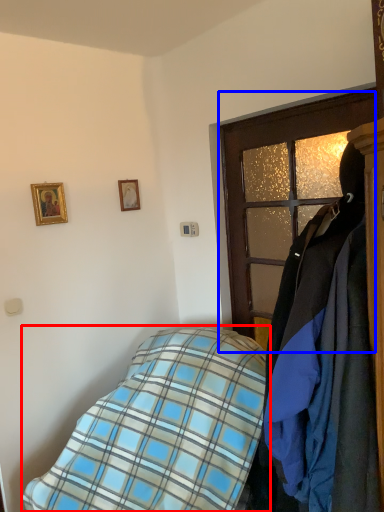
Question: Which object appears closest to the camera in this image, bed (highlighted by a red box) or door (highlighted by a blue box)?

Choices:
 (A) bed
 (B) door

Answer: (A)